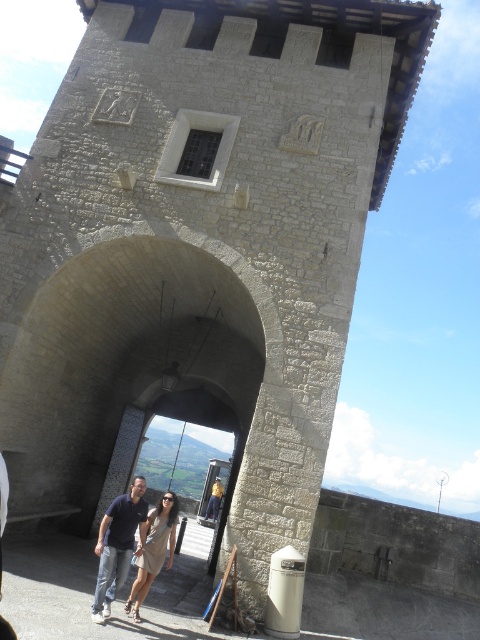
Does dark blue shirt at center have a smaller size compared to light beige dress at center?

No.

Which is above, dark blue shirt at center or light beige dress at center?

light beige dress at center is above.

What are the coordinates of `dark blue shirt at center` in the screenshot? It's located at (118, 545).